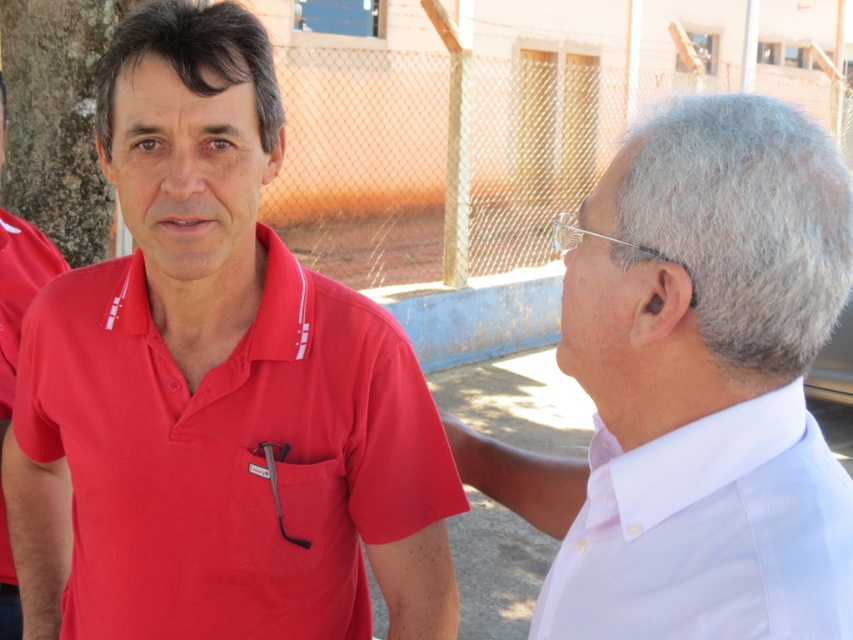
Between white glossy shirt at right and white textured shirt at right, which one appears on the left side from the viewer's perspective?

white glossy shirt at right

Can you confirm if white glossy shirt at right is shorter than white textured shirt at right?

No, white glossy shirt at right is not shorter than white textured shirt at right.

Who is more forward, [762,212] or [775,520]?

Point [775,520] is more forward.

This screenshot has height=640, width=853. I want to click on white glossy shirt at right, so click(695, 387).

Can you confirm if green rough bark at left is wider than matte red shirt at left?

Yes.

What do you see at coordinates (57, 118) in the screenshot? The image size is (853, 640). I see `green rough bark at left` at bounding box center [57, 118].

I want to click on green rough bark at left, so click(57, 118).

Between white textured shirt at right and matte red shirt at left, which one is positioned higher?

Positioned higher is matte red shirt at left.

Who is more forward, (572, 522) or (6, 289)?

Positioned in front is point (572, 522).

Identify the location of white textured shirt at right. The width and height of the screenshot is (853, 640). (708, 532).